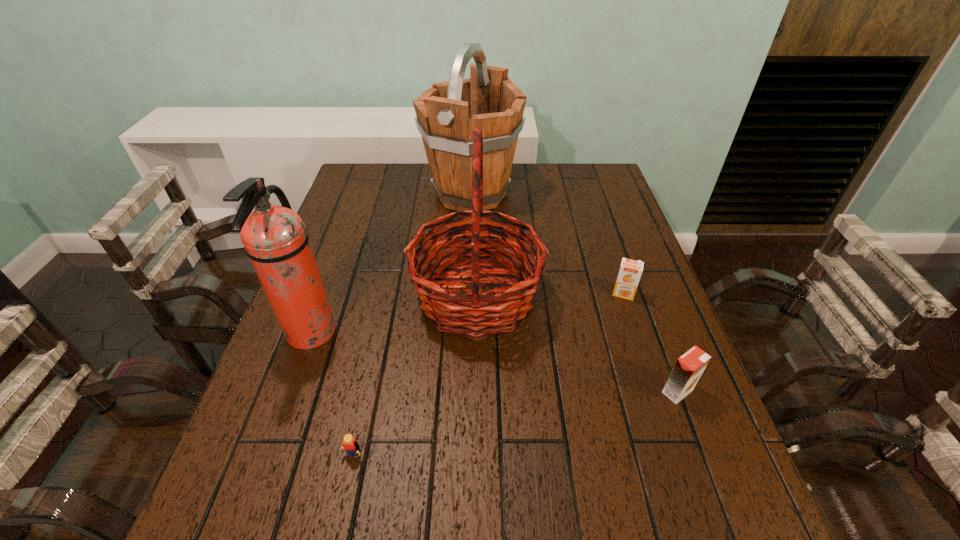
Where is `free space located on the left of the nearer orange juice`? Image resolution: width=960 pixels, height=540 pixels. free space located on the left of the nearer orange juice is located at coordinates (489, 392).

Find the location of a particular element. Image resolution: width=960 pixels, height=540 pixels. vacant space located on the left of the farther orange juice is located at coordinates (511, 294).

This screenshot has width=960, height=540. I want to click on object that is at the far edge, so click(x=447, y=114).

The height and width of the screenshot is (540, 960). Find the location of `object located in the left edge section of the desktop`. object located in the left edge section of the desktop is located at coordinates (274, 237).

In the image, there is a desktop. Where is `vacant space at the far edge`? This screenshot has height=540, width=960. vacant space at the far edge is located at coordinates (424, 194).

Image resolution: width=960 pixels, height=540 pixels. What are the coordinates of `free location at the left edge of the desktop` in the screenshot? It's located at (344, 221).

Locate an element on the screen. The image size is (960, 540). vacant space at the right edge of the desktop is located at coordinates (620, 258).

Locate an element on the screen. This screenshot has width=960, height=540. vacant space at the far left corner of the desktop is located at coordinates (353, 186).

Find the location of `free spot between the Lego and the fifth farthest object`. free spot between the Lego and the fifth farthest object is located at coordinates (515, 427).

You are a GUI agent. You are given a task and a screenshot of the screen. Output one action in this format:
    pyautogui.click(x=<x>, y=<y>)
    Task: Click on the free space between the fifth farthest object and the basket
    The height and width of the screenshot is (540, 960).
    Given the screenshot: What is the action you would take?
    pyautogui.click(x=577, y=345)